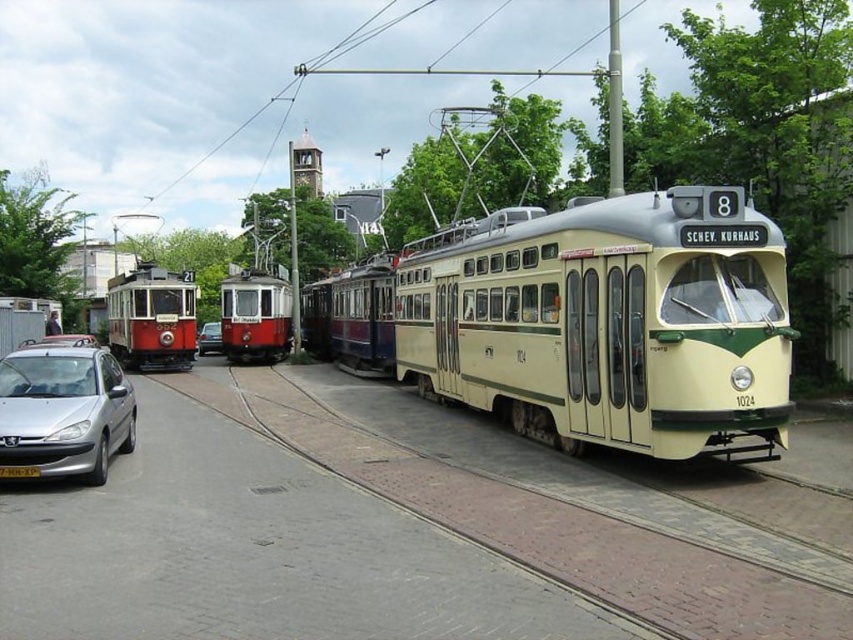
Question: Does silver metallic hatchback at lower left appear on the left side of metallic silver car at center?

Choices:
 (A) no
 (B) yes

Answer: (A)

Question: Is silver metallic hatchback at lower left smaller than metallic silver car at center?

Choices:
 (A) no
 (B) yes

Answer: (B)

Question: Which object is closer to the camera taking this photo?

Choices:
 (A) metallic silver car at center
 (B) silver metallic hatchback at lower left

Answer: (B)

Question: Is silver metallic hatchback at lower left below metallic silver car at center?

Choices:
 (A) no
 (B) yes

Answer: (B)